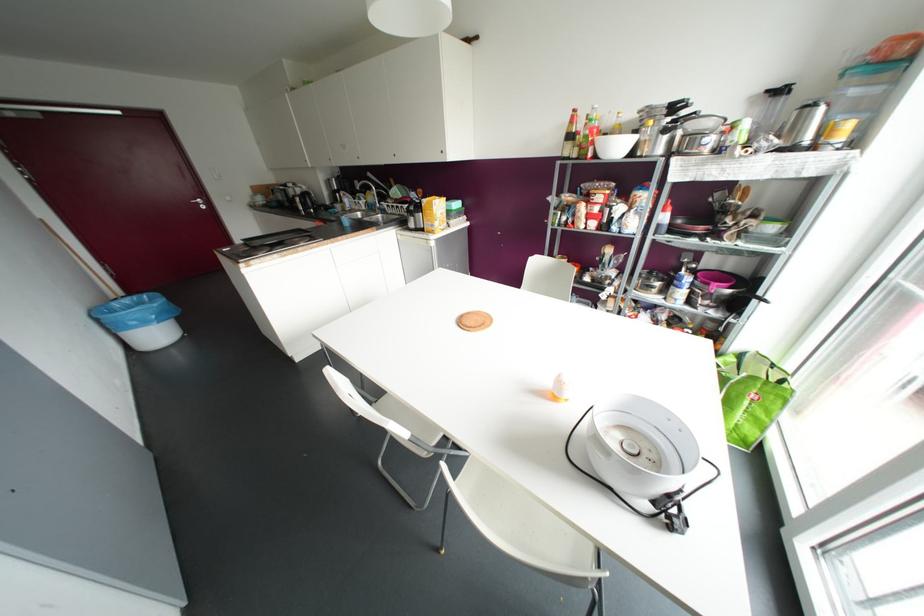
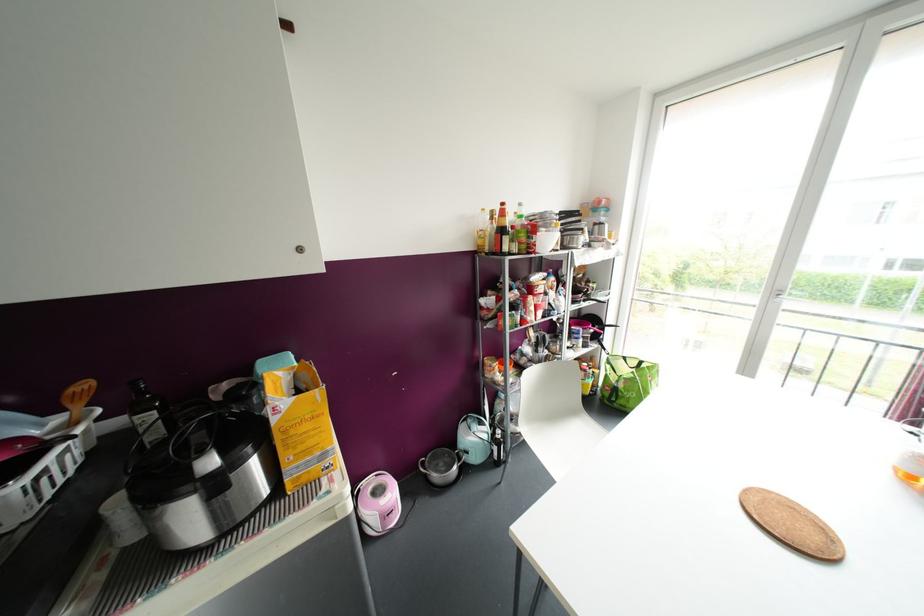
In the second image, find the point that corresponds to (772,365) in the first image.

(624, 358)